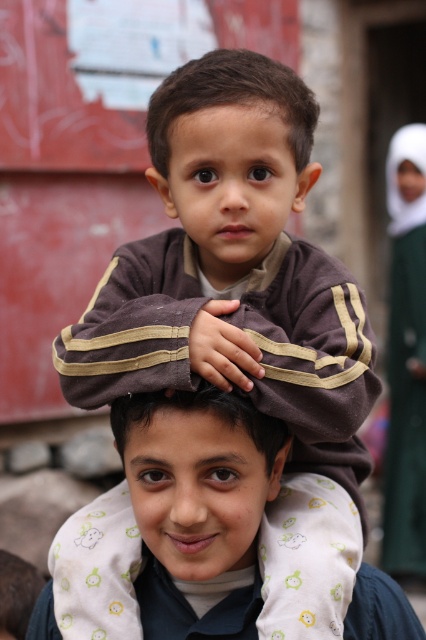
You are a photographer trying to capture a closeup of both the smooth brown hair at center and the green fabric at upper right in the image. Given their sizes, which one might require you to move closer to get a detailed shot?

The smooth brown hair at center occupies less space than the green fabric at upper right, so you would need to move closer to the smooth brown hair at center to capture its details.

You are a photographer trying to capture a closeup of the two children in the scene. You need to focus on the brown matte head at center and the smooth brown hair at center. Which object should you adjust your focus to first if you want to ensure both are in focus?

The brown matte head at center is bigger than the smooth brown hair at center, so you should focus on the brown matte head at center first to ensure both are in focus.